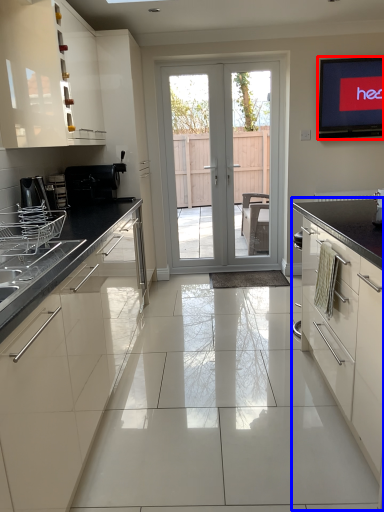
Question: Which object appears closest to the camera in this image, electronic (highlighted by a red box) or cabinetry (highlighted by a blue box)?

Choices:
 (A) electronic
 (B) cabinetry

Answer: (B)